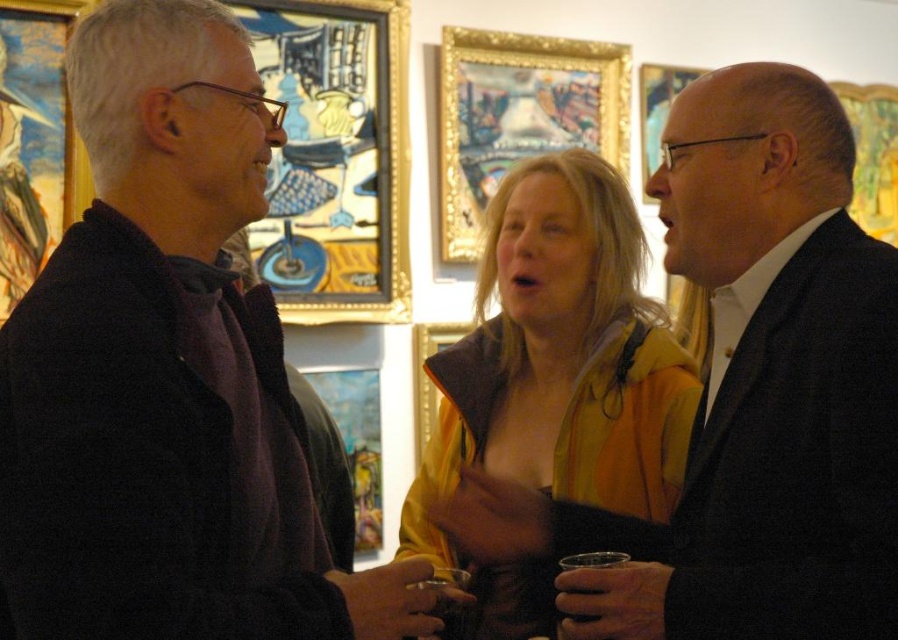
Question: Among these points, which one is nearest to the camera?

Choices:
 (A) (891, 125)
 (B) (377, 440)

Answer: (B)

Question: Which object appears farthest from the camera in this image?

Choices:
 (A) wooden picture frame at center
 (B) transparent plastic cup at center

Answer: (A)

Question: Is yellow matte jacket at center below wooden picture frame at center?

Choices:
 (A) yes
 (B) no

Answer: (A)

Question: Can you confirm if matte black suit at center is positioned to the right of translucent glass cup at center?

Choices:
 (A) no
 (B) yes

Answer: (B)

Question: Which object is farther from the camera taking this photo?

Choices:
 (A) dark woolen sweater at left
 (B) wooden picture frame at center

Answer: (B)

Question: Does gold/gilded picture frame at upper right have a greater width compared to metallic gold picture frame at upper center?

Choices:
 (A) no
 (B) yes

Answer: (B)